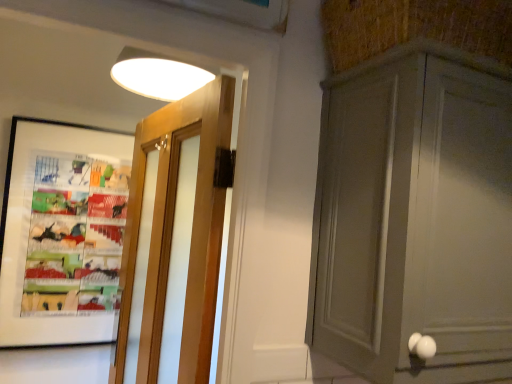
Question: From the image's perspective, is matte gray cabinet at right above or below wooden door at left?

Choices:
 (A) below
 (B) above

Answer: (B)

Question: Would you say matte gray cabinet at right is inside or outside wooden door at left?

Choices:
 (A) outside
 (B) inside

Answer: (A)

Question: Estimate the real-world distances between objects in this image. Which object is farther from the matte black picture frame at left?

Choices:
 (A) matte gray cabinet at right
 (B) wooden door at left

Answer: (A)

Question: Which object is the farthest from the matte black picture frame at left?

Choices:
 (A) wooden door at left
 (B) matte gray cabinet at right

Answer: (B)